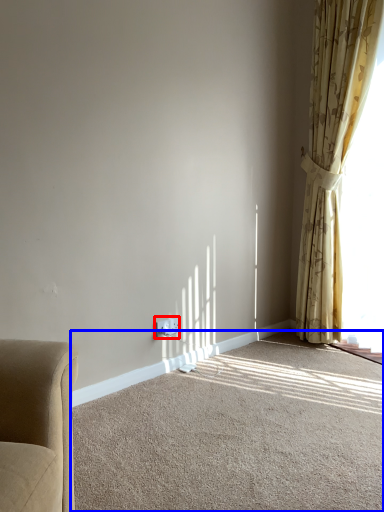
Question: Among these objects, which one is farthest to the camera, electric outlet (highlighted by a red box) or plain (highlighted by a blue box)?

Choices:
 (A) electric outlet
 (B) plain

Answer: (A)